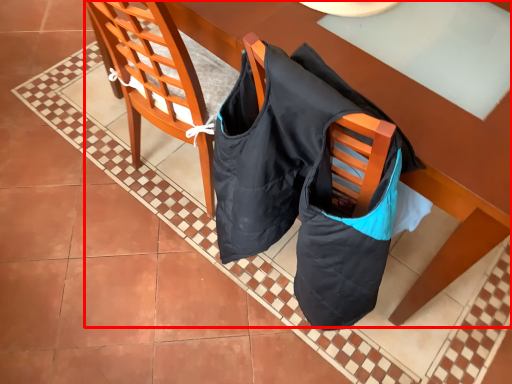
Question: From the image's perspective, what is the correct spatial positioning of table (annotated by the red box) in reference to chair?

Choices:
 (A) below
 (B) above

Answer: (B)